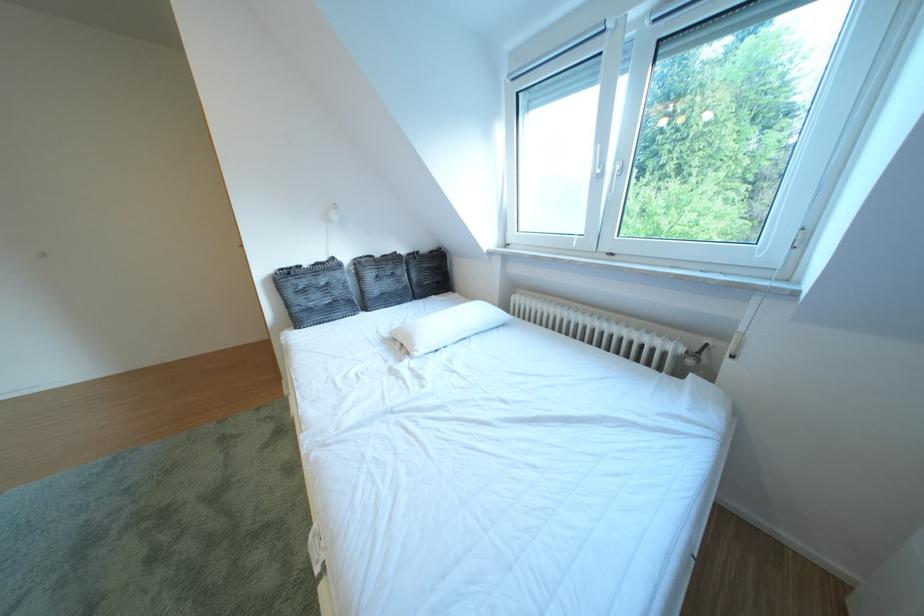
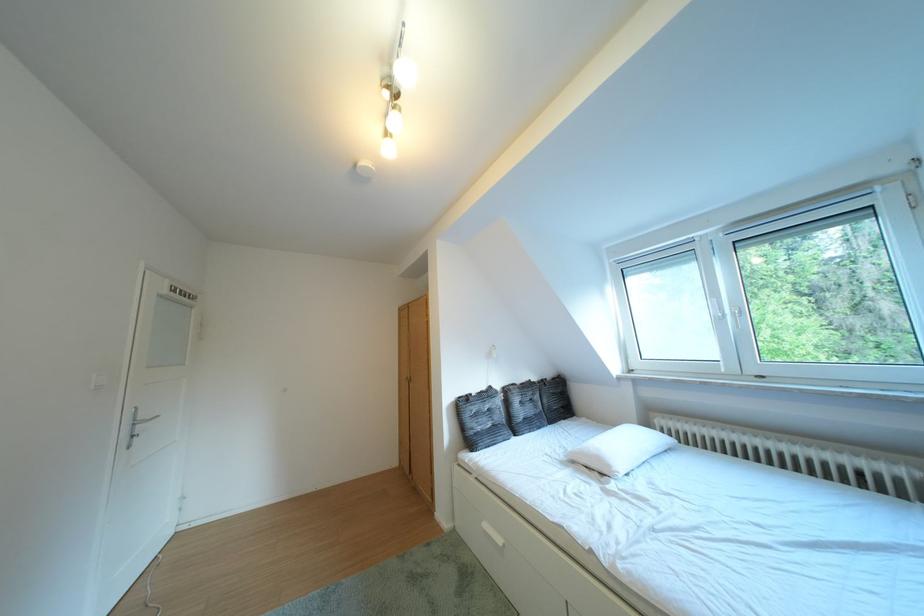
The point at (346, 264) is marked in the first image. Where is the corresponding point in the second image?

(504, 392)